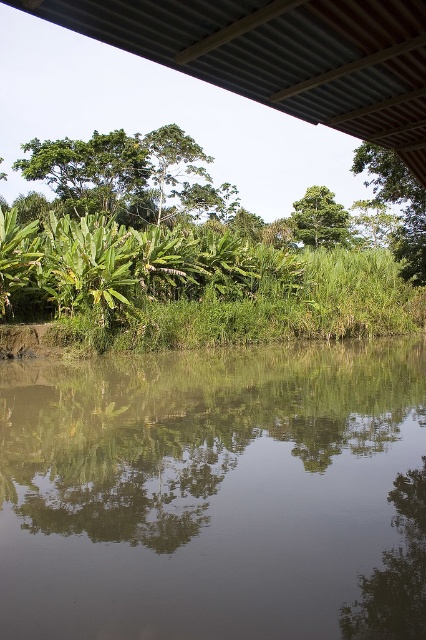
You are standing under the corrugated metal roof structure in the image. There is a point marked at coordinates [215,493]. What does this point correspond to in the scene?

The point at coordinates [215,493] corresponds to the green reflective water at center.

Looking at this image, you are standing under the corrugated metal roof and looking at the green reflective water at center and the green leafy tree at upper left. Which object appears taller in the scene?

The green leafy tree at upper left appears taller than the green reflective water at center.

You are standing under a corrugated metal roof and looking at the green reflective water at center and the green leafy tree at center. Which one is closer to you?

The green reflective water at center is closer to you because it is in front of the green leafy tree at center.